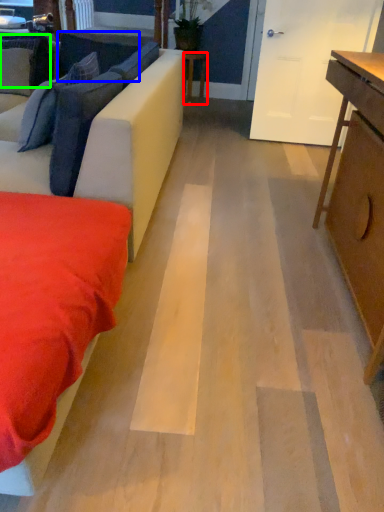
Question: Estimate the real-world distances between objects in this image. Which object is farther from table (highlighted by a red box), pillow (highlighted by a blue box) or pillow (highlighted by a green box)?

Choices:
 (A) pillow
 (B) pillow

Answer: (B)